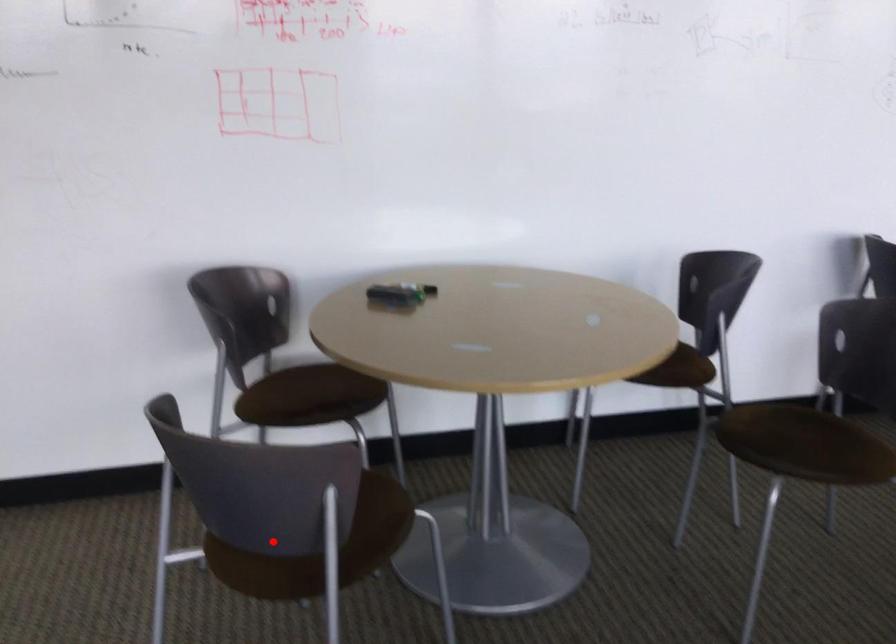
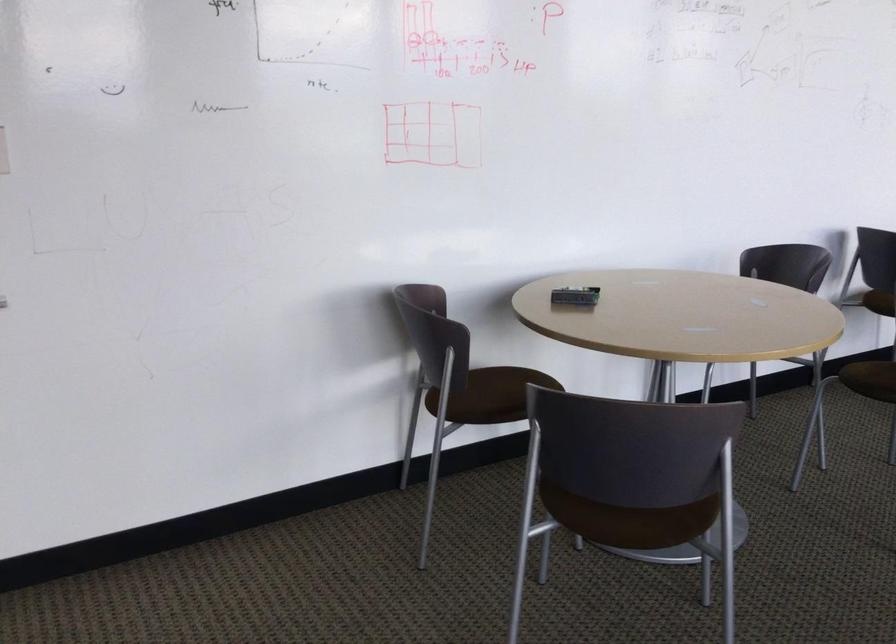
Question: I am providing you with two images of the same scene from different viewpoints. Given a red point in image1, look at the same physical point in image2. Is it:

Choices:
 (A) Closer to the viewpoint
 (B) Farther from the viewpoint

Answer: (B)